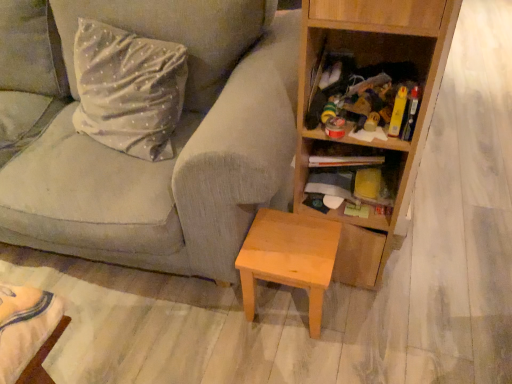
Question: From the image's perspective, is wooden shelf at center right under textured gray fabric couch at center?

Choices:
 (A) no
 (B) yes

Answer: (B)

Question: From the image's perspective, is wooden shelf at center right located above textured gray fabric couch at center?

Choices:
 (A) no
 (B) yes

Answer: (A)

Question: Is textured gray fabric couch at center a part of wooden shelf at center right?

Choices:
 (A) yes
 (B) no

Answer: (B)

Question: Is wooden shelf at center right positioned before textured gray fabric couch at center?

Choices:
 (A) yes
 (B) no

Answer: (B)

Question: Does wooden shelf at center right have a greater height compared to textured gray fabric couch at center?

Choices:
 (A) yes
 (B) no

Answer: (B)

Question: Is point (425, 3) closer or farther from the camera than point (325, 269)?

Choices:
 (A) closer
 (B) farther

Answer: (A)

Question: From their relative heights in the image, would you say wooden bookcase at right is taller or shorter than light brown wood stool at lower center?

Choices:
 (A) short
 (B) tall

Answer: (B)

Question: Considering their positions, is wooden bookcase at right located in front of or behind light brown wood stool at lower center?

Choices:
 (A) behind
 (B) front

Answer: (B)

Question: Is wooden bookcase at right inside the boundaries of light brown wood stool at lower center, or outside?

Choices:
 (A) inside
 (B) outside

Answer: (B)

Question: In terms of height, does light brown wood stool at lower center look taller or shorter compared to wooden shelf at center right?

Choices:
 (A) short
 (B) tall

Answer: (B)

Question: Would you say light brown wood stool at lower center is to the left or to the right of wooden shelf at center right in the picture?

Choices:
 (A) right
 (B) left

Answer: (B)

Question: Is light brown wood stool at lower center inside the boundaries of wooden shelf at center right, or outside?

Choices:
 (A) outside
 (B) inside

Answer: (A)

Question: From a real-world perspective, relative to wooden shelf at center right, is light brown wood stool at lower center vertically above or below?

Choices:
 (A) below
 (B) above

Answer: (A)

Question: Choose the correct answer: Is light brown wood stool at lower center inside wooden bookcase at right or outside it?

Choices:
 (A) outside
 (B) inside

Answer: (A)

Question: From the image's perspective, is light brown wood stool at lower center above or below wooden bookcase at right?

Choices:
 (A) above
 (B) below

Answer: (B)